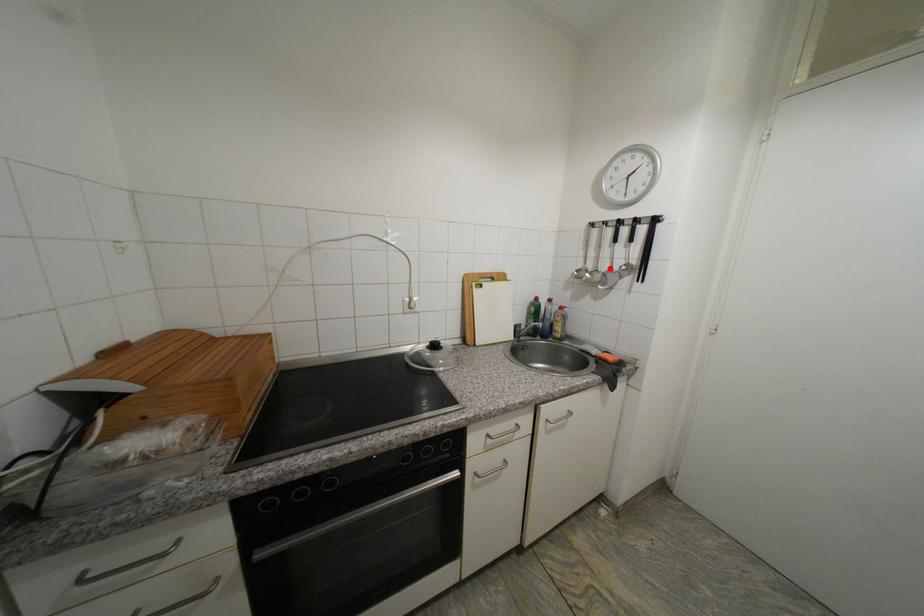
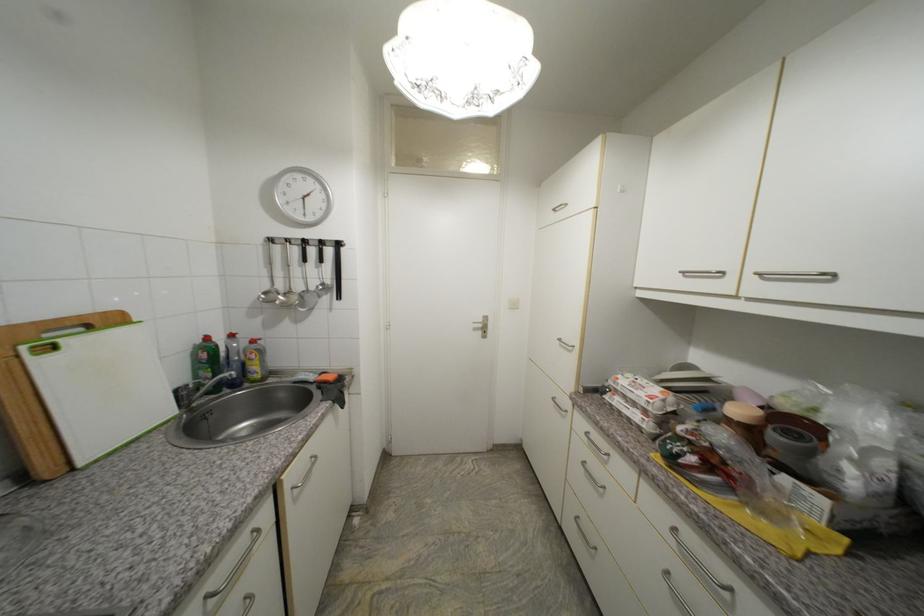
Locate, in the second image, the point that corresponds to the highlighted location in the first image.

(305, 289)